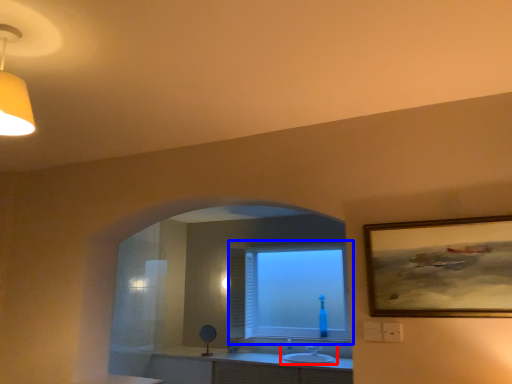
Question: Which object appears closest to the camera in this image, sink (highlighted by a red box) or window (highlighted by a blue box)?

Choices:
 (A) sink
 (B) window

Answer: (A)